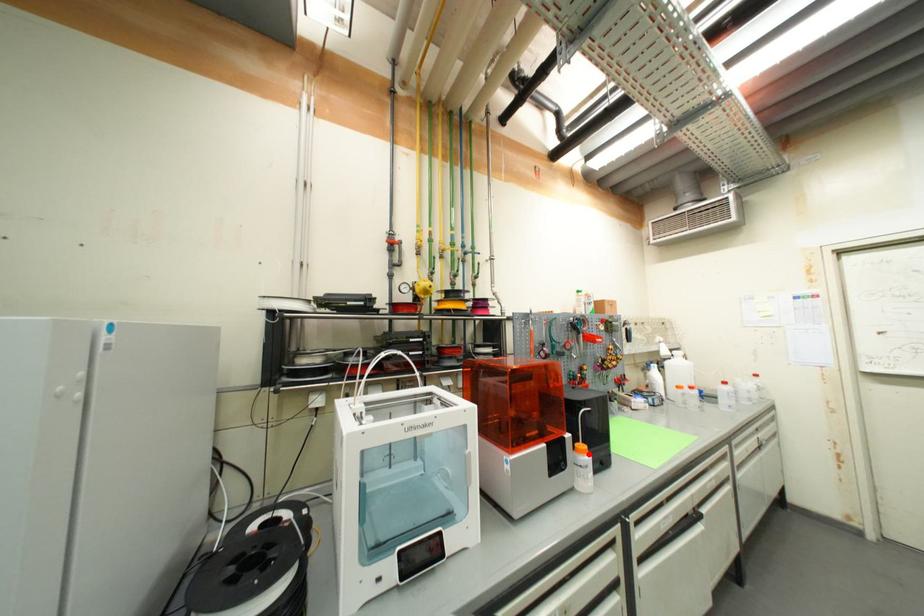
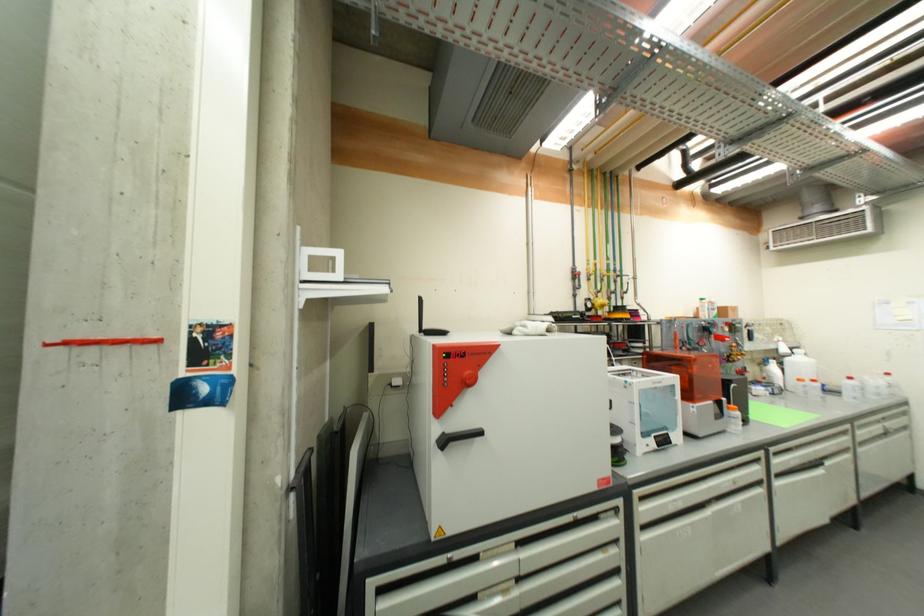
In the second image, find the point that corresponds to the highlighted location in the first image.

(739, 411)